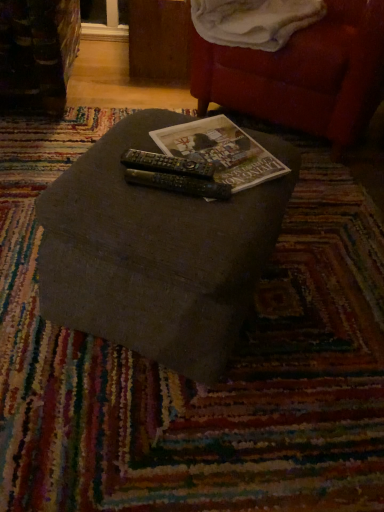
I want to click on unoccupied area in front of matte paper book at center, so click(193, 215).